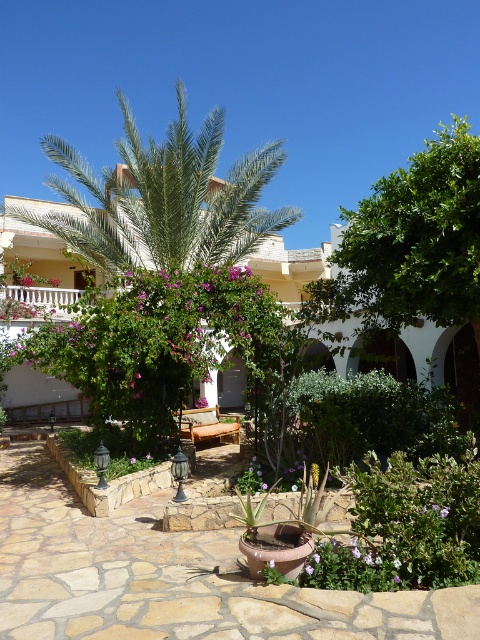
Who is taller, terracotta pot at center or green leafy tree at upper right?

green leafy tree at upper right

Locate an element on the screen. Image resolution: width=480 pixels, height=640 pixels. terracotta pot at center is located at coordinates (171, 577).

Which is in front, point (434, 243) or point (50, 276)?

Positioned in front is point (434, 243).

Who is lower down, green leafy tree at upper right or pink matte flower at upper center?

Positioned lower is pink matte flower at upper center.

Between point (404, 305) and point (54, 280), which one is positioned in front?

Point (404, 305) is more forward.

Where is `green leafy tree at upper right`? green leafy tree at upper right is located at coordinates (415, 260).

Looking at this image, measure the distance between point (147, 404) and camera.

The distance of point (147, 404) from camera is 8.09 meters.

Which of these two, green leafy palm tree at center or purple matte flower at center, stands taller?

With more height is green leafy palm tree at center.

Between point (135, 160) and point (20, 282), which one is positioned in front?

Point (135, 160) is more forward.

I want to click on green leafy palm tree at center, so click(159, 269).